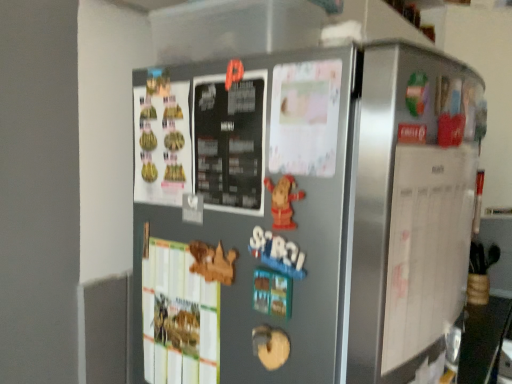
Where is `white paper at right`? white paper at right is located at coordinates (426, 247).

Measure the distance between point (449, 177) and camera.

Point (449, 177) is 63.60 centimeters from camera.

Describe the element at coordinates (426, 247) in the screenshot. The image size is (512, 384). I see `white paper at right` at that location.

Locate an element on the screen. satin silver refrigerator at center is located at coordinates (303, 214).

The height and width of the screenshot is (384, 512). Describe the element at coordinates (303, 214) in the screenshot. I see `satin silver refrigerator at center` at that location.

Where is `white paper at right`? white paper at right is located at coordinates (426, 247).

Between white paper at right and satin silver refrigerator at center, which one appears on the left side from the viewer's perspective?

Positioned to the left is satin silver refrigerator at center.

Looking at this image, which object is closer to the camera, white paper at right or satin silver refrigerator at center?

satin silver refrigerator at center is more forward.

Does point (430, 260) appear closer or farther from the camera than point (241, 163)?

Point (430, 260) is positioned closer to the camera compared to point (241, 163).

From the image's perspective, is white paper at right below satin silver refrigerator at center?

No, from the image's perspective, white paper at right is not below satin silver refrigerator at center.

Based on the photo, from a real-world perspective, is white paper at right physically located above or below satin silver refrigerator at center?

From a real-world perspective, white paper at right is physically above satin silver refrigerator at center.

Which object is wider, white paper at right or satin silver refrigerator at center?

satin silver refrigerator at center is wider.

Can you confirm if white paper at right is shorter than satin silver refrigerator at center?

Yes, white paper at right is shorter than satin silver refrigerator at center.

Is white paper at right bigger than satin silver refrigerator at center?

Actually, white paper at right might be smaller than satin silver refrigerator at center.

Is white paper at right inside or outside of satin silver refrigerator at center?

white paper at right exists outside the volume of satin silver refrigerator at center.

Is white paper at right positioned far away from satin silver refrigerator at center?

No, white paper at right is not far from satin silver refrigerator at center.

Looking at this image, is white paper at right facing towards satin silver refrigerator at center?

No, white paper at right is not facing towards satin silver refrigerator at center.

How different are the orientations of white paper at right and satin silver refrigerator at center in degrees?

85 degrees.

At what (x,y) coordinates should I click in order to perform the action: click on refrigerator below the white paper at right (from the image's perspective). Please return your answer as a coordinate pair (x, y). This screenshot has width=512, height=384. Looking at the image, I should click on (303, 214).

In the image, is satin silver refrigerator at center on the left side or the right side of white paper at right?

Based on their positions, satin silver refrigerator at center is located to the left of white paper at right.

Does satin silver refrigerator at center lie behind white paper at right?

No, it is not.

Which is less distant, (423, 355) or (409, 218)?

Point (423, 355) is farther from the camera than point (409, 218).

From the image's perspective, is satin silver refrigerator at center located above or below white paper at right?

satin silver refrigerator at center is situated lower than white paper at right in the image.

From a real-world perspective, which is physically below, satin silver refrigerator at center or white paper at right?

satin silver refrigerator at center.

Which object is thinner, satin silver refrigerator at center or white paper at right?

white paper at right is thinner.

Between satin silver refrigerator at center and white paper at right, which one has more height?

With more height is satin silver refrigerator at center.

Based on their sizes in the image, would you say satin silver refrigerator at center is bigger or smaller than white paper at right?

Clearly, satin silver refrigerator at center is larger in size than white paper at right.

Could white paper at right be considered to be inside satin silver refrigerator at center?

Actually, white paper at right is outside satin silver refrigerator at center.

Would you consider satin silver refrigerator at center to be distant from white paper at right?

No.

Is satin silver refrigerator at center positioned with its back to white paper at right?

No, satin silver refrigerator at center's orientation is not away from white paper at right.

How different are the orientations of satin silver refrigerator at center and white paper at right in degrees?

The facing directions of satin silver refrigerator at center and white paper at right are 85 degrees apart.

At what (x,y) coordinates should I click in order to perform the action: click on bulletin board that is above the satin silver refrigerator at center (from a real-world perspective). Please return your answer as a coordinate pair (x, y). This screenshot has width=512, height=384. Looking at the image, I should click on [x=426, y=247].

The image size is (512, 384). I want to click on refrigerator on the left of white paper at right, so click(303, 214).

Where is `bulletin board above the satin silver refrigerator at center (from the image's perspective)`? This screenshot has width=512, height=384. bulletin board above the satin silver refrigerator at center (from the image's perspective) is located at coordinates (426, 247).